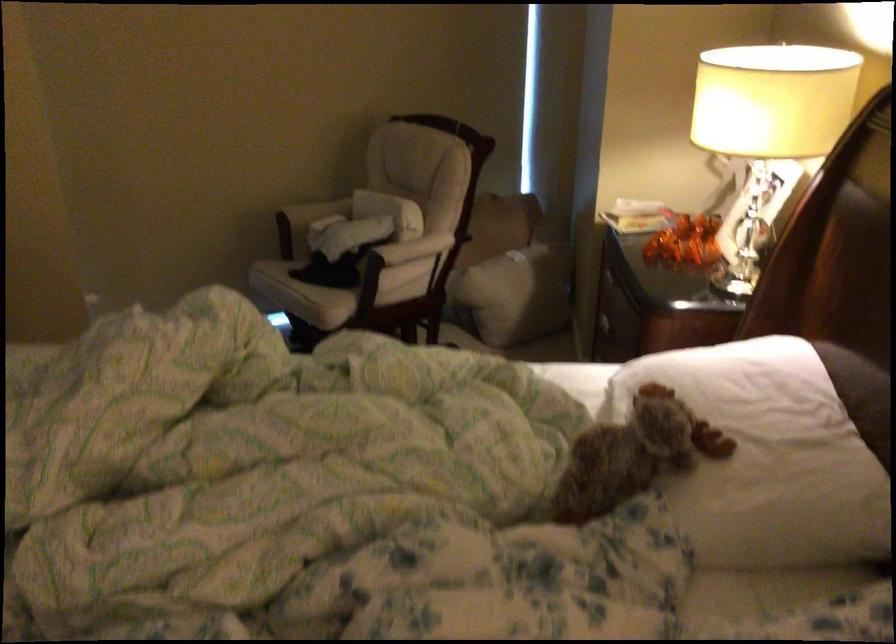
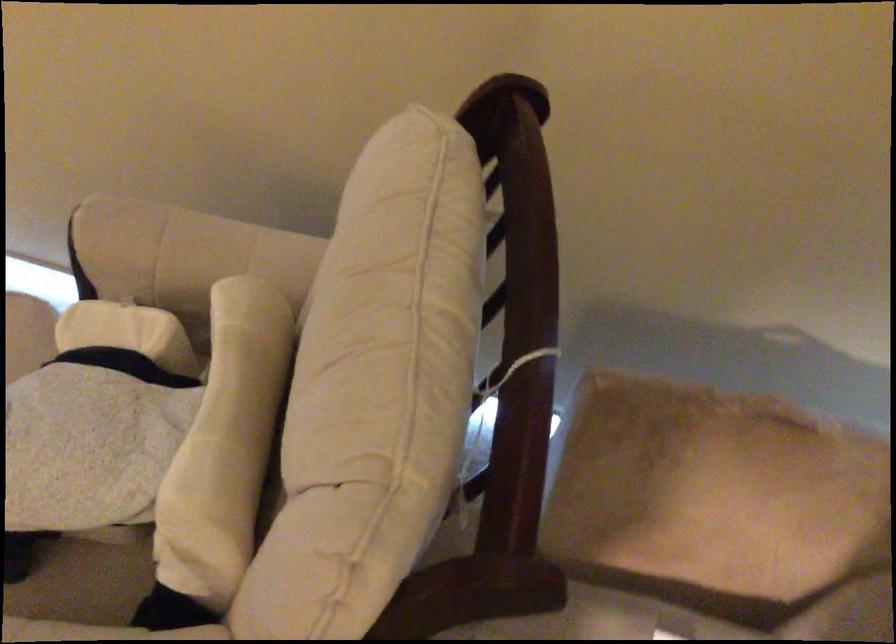
Where in the second image is the point corresponding to point (371, 279) from the first image?

(82, 583)